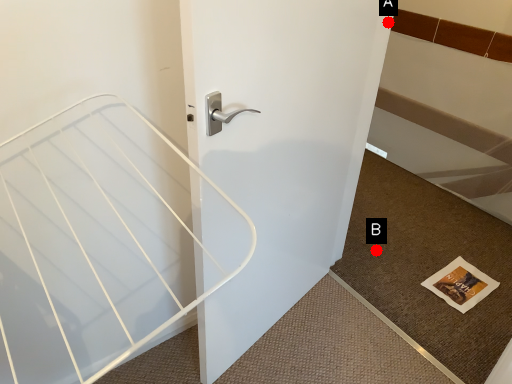
Question: Two points are circled on the image, labeled by A and B beside each circle. Which of the following is the farthest from the observer?

Choices:
 (A) A is further
 (B) B is further

Answer: (B)